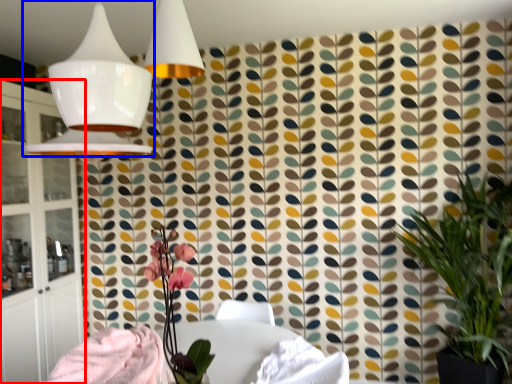
Question: Which object is further to the camera taking this photo, cabinetry (highlighted by a red box) or lamp (highlighted by a blue box)?

Choices:
 (A) cabinetry
 (B) lamp

Answer: (A)